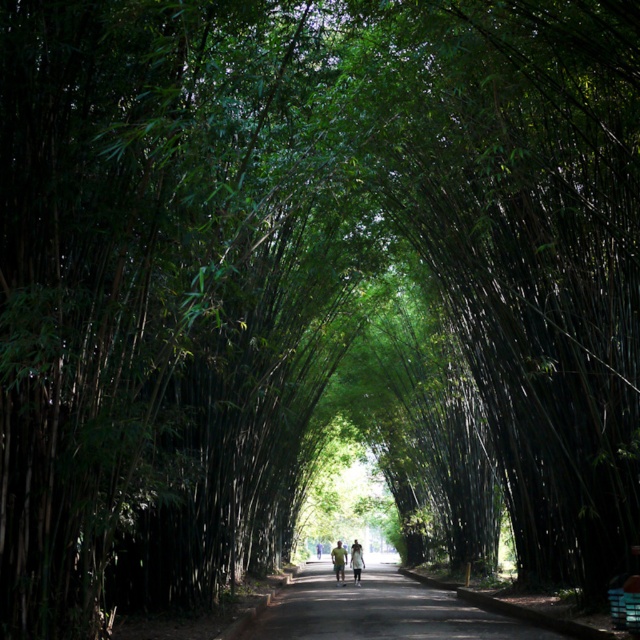
You are a photographer standing at the entrance of the bamboo pathway. You notice a light brown leather jacket at center and a light green fabric at center. Which object would block your view more if you were to look straight ahead? Please explain your reasoning based on their positions and sizes.

The light brown leather jacket at center is much taller than the light green fabric at center, so it would block your view more when looking straight ahead.

You are standing at the entrance of the bamboo pathway and notice a light brown leather jacket at center and a light green fabric at center. Which item is closer to you as you look down the path?

The light brown leather jacket at center is closer to you because the light green fabric at center is behind it.

You are standing on the pathway and want to determine which of the two points, point (339, 556) or point (353, 548), is closer to you. Based on the scene, which point is nearer?

Point (339, 556) is closer to the viewer than point (353, 548).